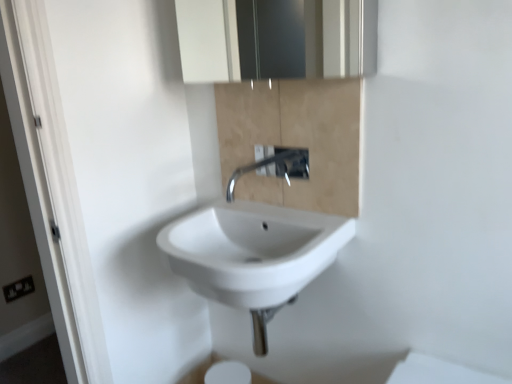
What is the approximate width of beige marble cabinet at center?

beige marble cabinet at center is 2.29 centimeters wide.

Locate an element on the screen. This screenshot has height=384, width=512. black plastic electrical outlet at lower left is located at coordinates (18, 289).

Find the location of `white glossy sink at center`. white glossy sink at center is located at coordinates (255, 247).

The height and width of the screenshot is (384, 512). Find the location of `beige marble cabinet at center`. beige marble cabinet at center is located at coordinates (294, 139).

Considering the positions of objects white glossy medicine cabinet at upper center and black plastic electrical outlet at lower left in the image provided, who is more to the left, white glossy medicine cabinet at upper center or black plastic electrical outlet at lower left?

Positioned to the left is black plastic electrical outlet at lower left.

Identify the location of medicine cabinet in front of the black plastic electrical outlet at lower left. Image resolution: width=512 pixels, height=384 pixels. (276, 39).

Are white glossy medicine cabinet at upper center and black plastic electrical outlet at lower left beside each other?

No, white glossy medicine cabinet at upper center is not beside black plastic electrical outlet at lower left.

Looking at this image, from the image's perspective, is white glossy medicine cabinet at upper center above or below black plastic electrical outlet at lower left?

Clearly, from the image's perspective, white glossy medicine cabinet at upper center is above black plastic electrical outlet at lower left.

Between point (256, 30) and point (196, 235), which one is positioned in front?

The point (196, 235) is closer.

Based on the photo, from a real-world perspective, is white glossy medicine cabinet at upper center physically located above or below white glossy sink at center?

In terms of real-world spatial position, white glossy medicine cabinet at upper center is above white glossy sink at center.

Relative to white glossy sink at center, is white glossy medicine cabinet at upper center in front or behind?

Clearly, white glossy medicine cabinet at upper center is behind white glossy sink at center.

Is there a large distance between white glossy medicine cabinet at upper center and white glossy sink at center?

Yes, white glossy medicine cabinet at upper center is far from white glossy sink at center.

Is point (300, 5) less distant than point (303, 102)?

No, (300, 5) is further to viewer.

Based on the photo, is white glossy medicine cabinet at upper center located outside beige marble cabinet at center?

That's correct, white glossy medicine cabinet at upper center is outside of beige marble cabinet at center.

This screenshot has width=512, height=384. In order to click on medicine cabinet above the beige marble cabinet at center (from a real-world perspective) in this screenshot , I will do tap(276, 39).

This screenshot has width=512, height=384. What are the coordinates of `sink below the beige marble cabinet at center (from a real-world perspective)` in the screenshot? It's located at (255, 247).

Can you confirm if white glossy sink at center is positioned to the right of beige marble cabinet at center?

In fact, white glossy sink at center is to the left of beige marble cabinet at center.

How different are the orientations of white glossy sink at center and beige marble cabinet at center in degrees?

The facing directions of white glossy sink at center and beige marble cabinet at center are 0.00845 degrees apart.

Which is closer to the camera, [316,232] or [250,123]?

Clearly, point [316,232] is closer to the camera than point [250,123].

In the image, is white glossy sink at center on the left side or the right side of black plastic electrical outlet at lower left?

white glossy sink at center is positioned on black plastic electrical outlet at lower left's right side.

In the scene shown: Considering the relative sizes of white glossy sink at center and black plastic electrical outlet at lower left in the image provided, is white glossy sink at center shorter than black plastic electrical outlet at lower left?

No.

What's the angular difference between white glossy sink at center and black plastic electrical outlet at lower left's facing directions?

90.9 degrees separate the facing orientations of white glossy sink at center and black plastic electrical outlet at lower left.

Does white glossy medicine cabinet at upper center have a larger size compared to satin chrome faucet at center?

Correct, white glossy medicine cabinet at upper center is larger in size than satin chrome faucet at center.

Is point (231, 0) positioned behind point (233, 175)?

Yes, it is.

I want to click on tap behind the white glossy medicine cabinet at upper center, so click(x=264, y=166).

Does black plastic electrical outlet at lower left have a larger size compared to white glossy medicine cabinet at upper center?

Incorrect, black plastic electrical outlet at lower left is not larger than white glossy medicine cabinet at upper center.

Is black plastic electrical outlet at lower left to the left of white glossy medicine cabinet at upper center from the viewer's perspective?

Yes.

Based on the photo, from a real-world perspective, is black plastic electrical outlet at lower left below white glossy medicine cabinet at upper center?

Indeed, from a real-world perspective, black plastic electrical outlet at lower left is positioned beneath white glossy medicine cabinet at upper center.

Where is `electric outlet below the white glossy medicine cabinet at upper center (from the image's perspective)`? The width and height of the screenshot is (512, 384). electric outlet below the white glossy medicine cabinet at upper center (from the image's perspective) is located at coordinates (18, 289).

Locate an element on the screen. medicine cabinet behind the white glossy sink at center is located at coordinates pos(276,39).

Considering their positions, is beige marble cabinet at center positioned further to satin chrome faucet at center than white glossy medicine cabinet at upper center?

A: The object further to satin chrome faucet at center is white glossy medicine cabinet at upper center.

Looking at the image, which one is located closer to white glossy sink at center, satin chrome faucet at center or white glossy medicine cabinet at upper center?

satin chrome faucet at center lies closer to white glossy sink at center than the other object.

Estimate the real-world distances between objects in this image. Which object is further from black plastic electrical outlet at lower left, white glossy medicine cabinet at upper center or satin chrome faucet at center?

white glossy medicine cabinet at upper center.

Considering their positions, is white glossy medicine cabinet at upper center positioned closer to beige marble cabinet at center than black plastic electrical outlet at lower left?

black plastic electrical outlet at lower left is positioned closer to the anchor beige marble cabinet at center.

Which object lies nearer to the anchor point black plastic electrical outlet at lower left, satin chrome faucet at center or white glossy sink at center?

satin chrome faucet at center.

Considering their positions, is satin chrome faucet at center positioned further to white glossy medicine cabinet at upper center than white glossy sink at center?

The object further to white glossy medicine cabinet at upper center is white glossy sink at center.

From the image, which object appears to be farther from black plastic electrical outlet at lower left, white glossy medicine cabinet at upper center or white glossy sink at center?

white glossy medicine cabinet at upper center lies further to black plastic electrical outlet at lower left than the other object.

Which object lies nearer to the anchor point black plastic electrical outlet at lower left, satin chrome faucet at center or beige marble cabinet at center?

Based on the image, satin chrome faucet at center appears to be nearer to black plastic electrical outlet at lower left.

Where is `sink located between black plastic electrical outlet at lower left and beige marble cabinet at center in the left-right direction`? This screenshot has width=512, height=384. sink located between black plastic electrical outlet at lower left and beige marble cabinet at center in the left-right direction is located at coordinates (255, 247).

Identify the location of medicine cabinet situated between black plastic electrical outlet at lower left and satin chrome faucet at center from left to right. The width and height of the screenshot is (512, 384). (276, 39).

What are the coordinates of `sink between black plastic electrical outlet at lower left and white glossy medicine cabinet at upper center` in the screenshot? It's located at 255,247.

I want to click on tap between beige marble cabinet at center and white glossy sink at center from top to bottom, so click(264, 166).